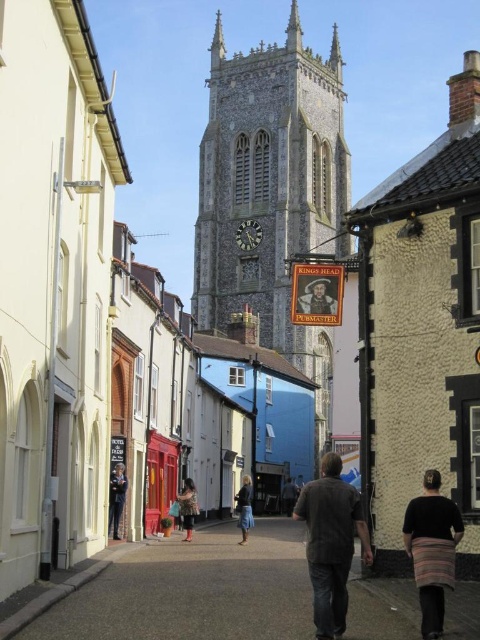
Question: Is the position of stone clock tower at center less distant than that of smooth asphalt alley at center?

Choices:
 (A) no
 (B) yes

Answer: (A)

Question: Can you confirm if stone clock tower at center is positioned below black knitwear at lower right?

Choices:
 (A) yes
 (B) no

Answer: (B)

Question: Is stone clock tower at center in front of denim shorts at center?

Choices:
 (A) yes
 (B) no

Answer: (A)

Question: Estimate the real-world distances between objects in this image. Which object is closer to the black knitwear at lower right?

Choices:
 (A) dark blue jeans at lower left
 (B) denim shorts at center

Answer: (A)

Question: Which of the following is the closest to the observer?

Choices:
 (A) denim shorts at center
 (B) black knitwear at lower right
 (C) stone clock tower at center

Answer: (B)

Question: Which point is farther from the camera taking this photo?

Choices:
 (A) pos(240,504)
 (B) pos(328,531)
 (C) pos(289,236)
 (D) pos(184,522)

Answer: (C)